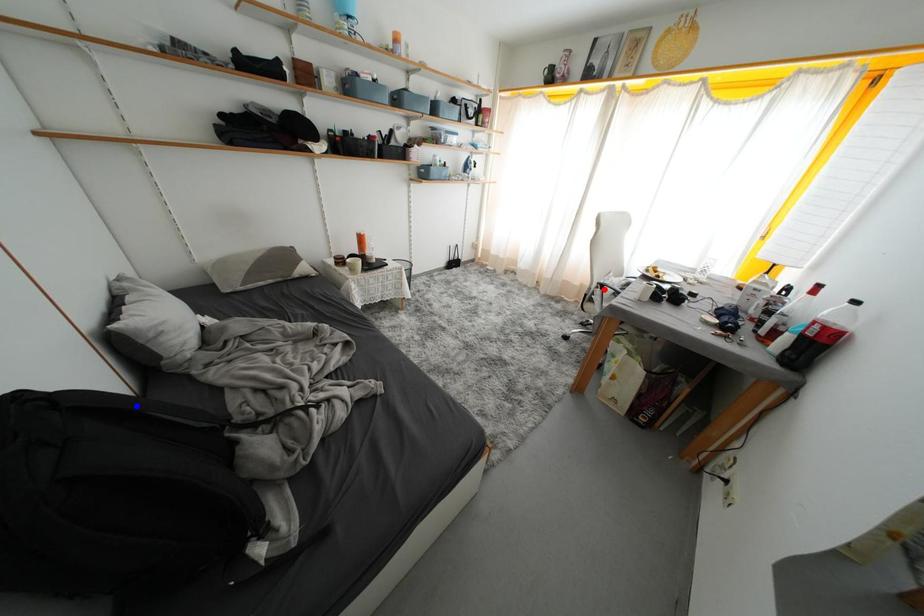
Question: Which of the two points in the image is closer to the camera?

Choices:
 (A) Blue point is closer.
 (B) Red point is closer.

Answer: (A)